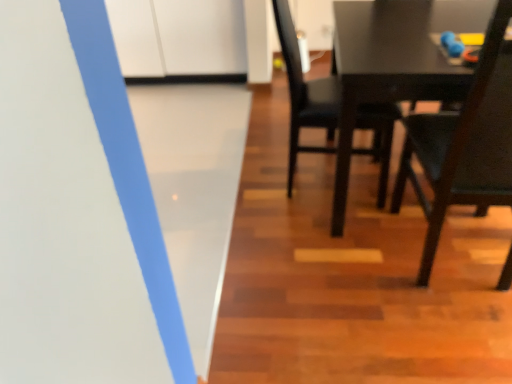
In order to face matte black chair at center, the second chair in the right-to-left sequence, should I rotate leftwards or rightwards?

You should look right and rotate roughly 9.680 degrees.

What do you see at coordinates (304, 93) in the screenshot? I see `matte black chair at center, the second chair in the right-to-left sequence` at bounding box center [304, 93].

At what (x,y) coordinates should I click in order to perform the action: click on matte black chair at center, marked as the first chair in a left-to-right arrangement. Please return your answer as a coordinate pair (x, y). The width and height of the screenshot is (512, 384). Looking at the image, I should click on (304, 93).

The image size is (512, 384). What do you see at coordinates (465, 143) in the screenshot?
I see `dark wood chair at right, the first chair when ordered from right to left` at bounding box center [465, 143].

Where is `dark wood chair at right, the first chair when ordered from right to left`? Image resolution: width=512 pixels, height=384 pixels. dark wood chair at right, the first chair when ordered from right to left is located at coordinates (465, 143).

Where is `matte black chair at center, the second chair in the right-to-left sequence`? The width and height of the screenshot is (512, 384). matte black chair at center, the second chair in the right-to-left sequence is located at coordinates (304, 93).

Based on their positions, is matte black chair at center, the second chair in the right-to-left sequence, located to the left or right of dark wood chair at right, the first chair when ordered from right to left?

From the image, it's evident that matte black chair at center, the second chair in the right-to-left sequence, is to the left of dark wood chair at right, the first chair when ordered from right to left.

Is matte black chair at center, the second chair in the right-to-left sequence, closer to the viewer compared to dark wood chair at right, the 2th chair viewed from the left?

No, the depth of matte black chair at center, the second chair in the right-to-left sequence, is greater than that of dark wood chair at right, the 2th chair viewed from the left.

Which is nearer, [302,79] or [414,120]?

The point [414,120] is in front.

From the image's perspective, which one is positioned lower, matte black chair at center, the second chair in the right-to-left sequence, or dark wood chair at right, the first chair when ordered from right to left?

dark wood chair at right, the first chair when ordered from right to left, from the image's perspective.

From a real-world perspective, is matte black chair at center, the second chair in the right-to-left sequence, located beneath dark wood chair at right, the 2th chair viewed from the left?

Correct, in the physical world, matte black chair at center, the second chair in the right-to-left sequence, is lower than dark wood chair at right, the 2th chair viewed from the left.

Which object is wider, matte black chair at center, marked as the first chair in a left-to-right arrangement, or dark wood chair at right, the 2th chair viewed from the left?

dark wood chair at right, the 2th chair viewed from the left.

Considering the relative sizes of matte black chair at center, marked as the first chair in a left-to-right arrangement, and dark wood chair at right, the 2th chair viewed from the left, in the image provided, is matte black chair at center, marked as the first chair in a left-to-right arrangement, taller than dark wood chair at right, the 2th chair viewed from the left,?

In fact, matte black chair at center, marked as the first chair in a left-to-right arrangement, may be shorter than dark wood chair at right, the 2th chair viewed from the left.

Looking at the image, does matte black chair at center, the second chair in the right-to-left sequence, seem bigger or smaller compared to dark wood chair at right, the 2th chair viewed from the left?

Clearly, matte black chair at center, the second chair in the right-to-left sequence, is smaller in size than dark wood chair at right, the 2th chair viewed from the left.

Choose the correct answer: Is matte black chair at center, marked as the first chair in a left-to-right arrangement, inside dark wood chair at right, the first chair when ordered from right to left, or outside it?

matte black chair at center, marked as the first chair in a left-to-right arrangement, is spatially situated outside dark wood chair at right, the first chair when ordered from right to left.

Is matte black chair at center, the second chair in the right-to-left sequence, next to dark wood chair at right, the first chair when ordered from right to left?

No, matte black chair at center, the second chair in the right-to-left sequence, is not touching dark wood chair at right, the first chair when ordered from right to left.

Is matte black chair at center, marked as the first chair in a left-to-right arrangement, facing towards dark wood chair at right, the 2th chair viewed from the left?

No, matte black chair at center, marked as the first chair in a left-to-right arrangement, is not aimed at dark wood chair at right, the 2th chair viewed from the left.

Can you tell me how much matte black chair at center, the second chair in the right-to-left sequence, and dark wood chair at right, the first chair when ordered from right to left, differ in facing direction?

They differ by 82.1 degrees in their facing directions.

Identify the location of chair on the left of dark wood chair at right, the 2th chair viewed from the left. The image size is (512, 384). (304, 93).

Would you say dark wood chair at right, the 2th chair viewed from the left, is to the left or to the right of matte black chair at center, marked as the first chair in a left-to-right arrangement, in the picture?

Clearly, dark wood chair at right, the 2th chair viewed from the left, is on the right of matte black chair at center, marked as the first chair in a left-to-right arrangement, in the image.

Relative to matte black chair at center, marked as the first chair in a left-to-right arrangement, is dark wood chair at right, the first chair when ordered from right to left, in front or behind?

dark wood chair at right, the first chair when ordered from right to left, is in front of matte black chair at center, marked as the first chair in a left-to-right arrangement.

Is point (437, 177) less distant than point (333, 99)?

That is True.

From the image's perspective, is dark wood chair at right, the first chair when ordered from right to left, on matte black chair at center, marked as the first chair in a left-to-right arrangement?

No, from the image's perspective, dark wood chair at right, the first chair when ordered from right to left, is not on top of matte black chair at center, marked as the first chair in a left-to-right arrangement.

Consider the image. From a real-world perspective, which is physically above, dark wood chair at right, the first chair when ordered from right to left, or matte black chair at center, marked as the first chair in a left-to-right arrangement?

dark wood chair at right, the first chair when ordered from right to left, from a real-world perspective.

Which of these two, dark wood chair at right, the 2th chair viewed from the left, or matte black chair at center, the second chair in the right-to-left sequence, is wider?

Wider between the two is dark wood chair at right, the 2th chair viewed from the left.

Between dark wood chair at right, the 2th chair viewed from the left, and matte black chair at center, marked as the first chair in a left-to-right arrangement, which one has more height?

Standing taller between the two is dark wood chair at right, the 2th chair viewed from the left.

Is dark wood chair at right, the first chair when ordered from right to left, bigger than matte black chair at center, the second chair in the right-to-left sequence?

Correct, dark wood chair at right, the first chair when ordered from right to left, is larger in size than matte black chair at center, the second chair in the right-to-left sequence.

Is dark wood chair at right, the 2th chair viewed from the left, not inside matte black chair at center, marked as the first chair in a left-to-right arrangement?

dark wood chair at right, the 2th chair viewed from the left, is positioned outside matte black chair at center, marked as the first chair in a left-to-right arrangement.

Is dark wood chair at right, the first chair when ordered from right to left, not near matte black chair at center, the second chair in the right-to-left sequence?

No, dark wood chair at right, the first chair when ordered from right to left, is in close proximity to matte black chair at center, the second chair in the right-to-left sequence.

Is dark wood chair at right, the first chair when ordered from right to left, facing towards matte black chair at center, marked as the first chair in a left-to-right arrangement?

No, dark wood chair at right, the first chair when ordered from right to left, is not oriented towards matte black chair at center, marked as the first chair in a left-to-right arrangement.

From the picture: What's the angular difference between dark wood chair at right, the first chair when ordered from right to left, and matte black chair at center, the second chair in the right-to-left sequence,'s facing directions?

82.1 degrees separate the facing orientations of dark wood chair at right, the first chair when ordered from right to left, and matte black chair at center, the second chair in the right-to-left sequence.

In the image, there is a dark wood chair at right, the first chair when ordered from right to left. Find the location of `chair above it (from the image's perspective)`. chair above it (from the image's perspective) is located at coordinates click(x=304, y=93).

Where is `chair above the dark wood chair at right, the 2th chair viewed from the left (from the image's perspective)`? chair above the dark wood chair at right, the 2th chair viewed from the left (from the image's perspective) is located at coordinates (304, 93).

In order to click on chair below the matte black chair at center, marked as the first chair in a left-to-right arrangement (from the image's perspective) in this screenshot , I will do `click(465, 143)`.